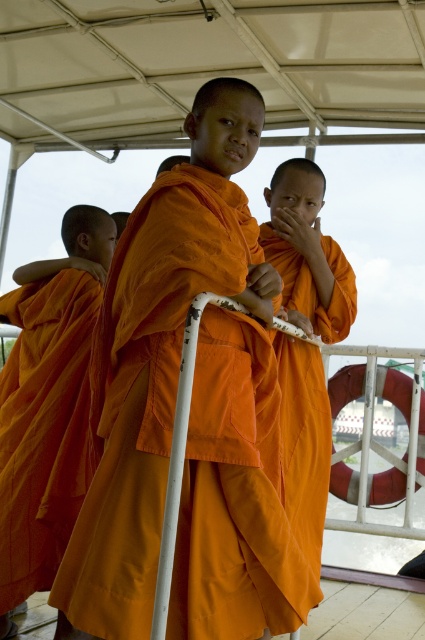
Question: Is orange cloth at center to the right of orange clothed monk at center from the viewer's perspective?

Choices:
 (A) yes
 (B) no

Answer: (B)

Question: Is orange cloth robe at center thinner than orange cloth at center?

Choices:
 (A) no
 (B) yes

Answer: (A)

Question: Can you confirm if orange cloth robe at center is bigger than orange clothed monk at center?

Choices:
 (A) yes
 (B) no

Answer: (A)

Question: Which point is farther to the camera?

Choices:
 (A) (14, 541)
 (B) (312, 209)

Answer: (B)

Question: Which object is positioned farthest from the orange cloth robe at center?

Choices:
 (A) orange clothed monk at center
 (B) orange cloth at center

Answer: (B)

Question: Which point appears closest to the camera in this image?

Choices:
 (A) (203, 276)
 (B) (42, 499)
 (C) (311, 288)

Answer: (A)